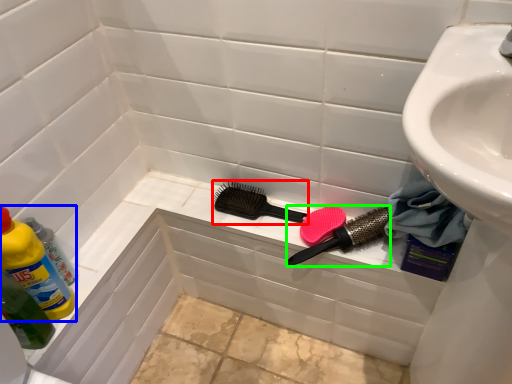
Question: Which object is positioned closest to brush (highlighted by a red box)? Select from cleaning product (highlighted by a blue box) and brush (highlighted by a green box).

Choices:
 (A) cleaning product
 (B) brush

Answer: (B)